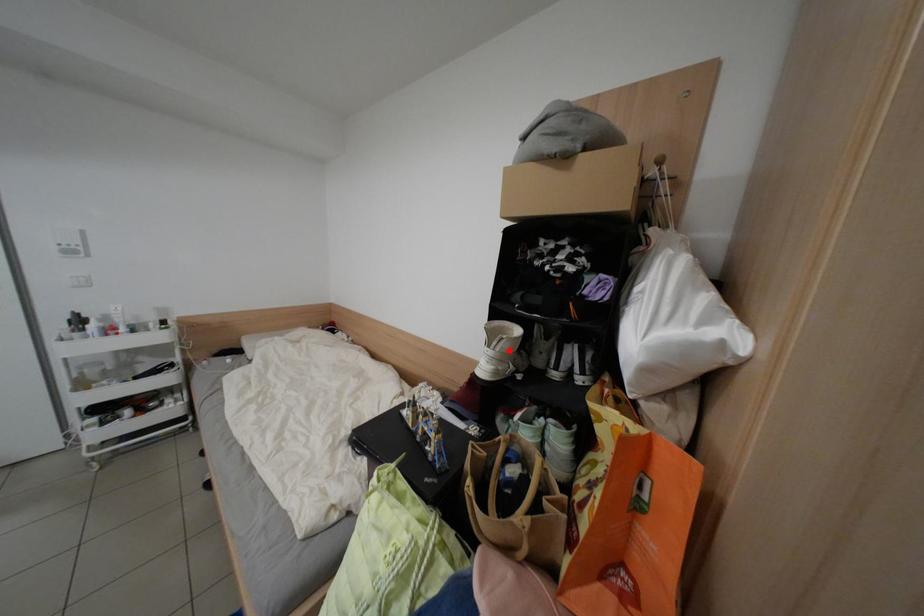
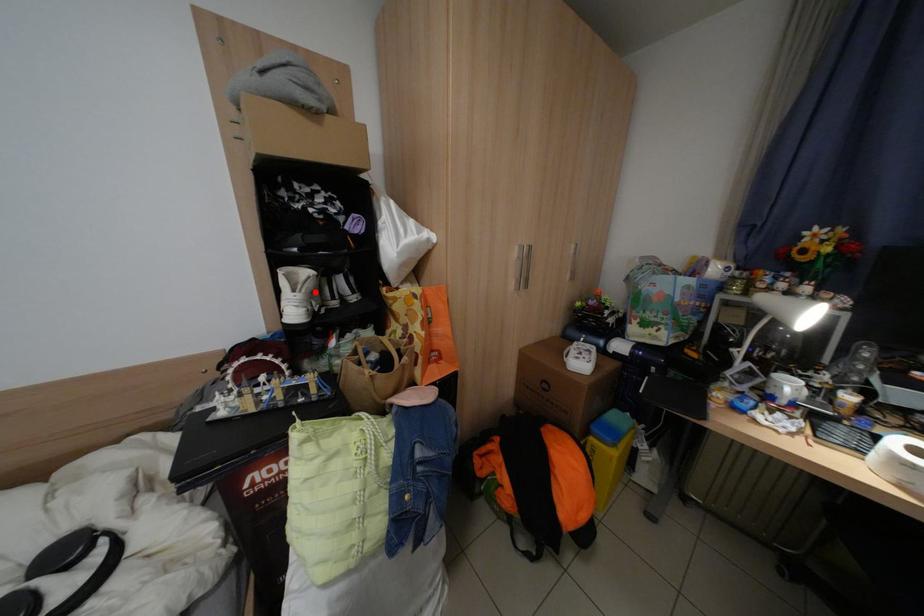
I am providing you with two images of the same scene from different viewpoints. A red point is marked on the first image and another point is marked on the second image. Is the red point in image1 aligned with the point shown in image2?

Yes